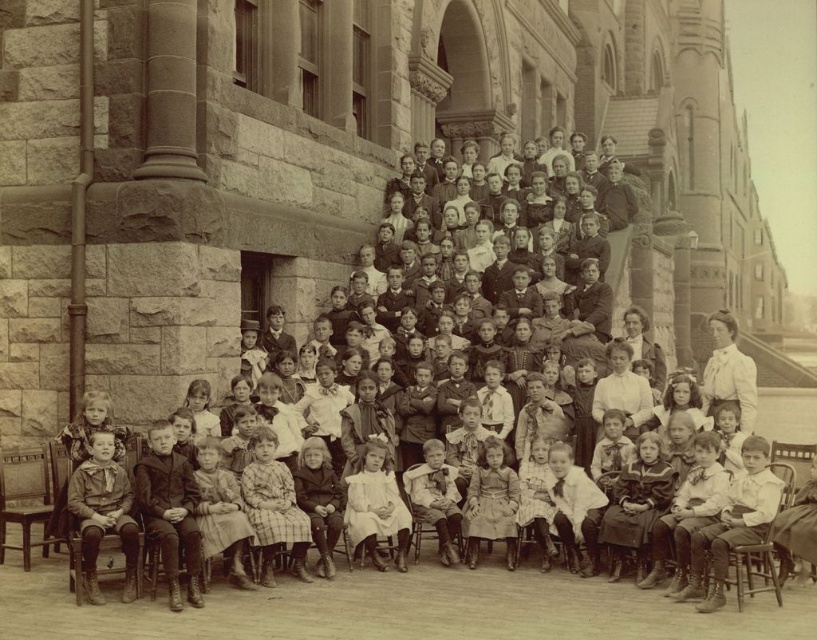
Question: Observing the image, what is the correct spatial positioning of matte brown boots at lower left in reference to white lace blouse at upper right?

Choices:
 (A) right
 (B) left

Answer: (B)

Question: Is matte brown boots at lower left closer to the viewer compared to wooden chair at lower left?

Choices:
 (A) yes
 (B) no

Answer: (A)

Question: Where is matte brown boots at lower left located in relation to wooden at right in the image?

Choices:
 (A) left
 (B) right

Answer: (A)

Question: Which point is closer to the camera?

Choices:
 (A) matte brown boots at lower left
 (B) wooden at right
 (C) wooden chair at lower left
 (D) white lace blouse at upper right

Answer: (A)

Question: Based on their relative distances, which object is farther from the wooden at right?

Choices:
 (A) white lace blouse at upper right
 (B) matte brown boots at lower left
 (C) wooden chair at lower left

Answer: (A)

Question: Among these points, which one is farthest from the camera?

Choices:
 (A) (735, 332)
 (B) (43, 497)

Answer: (A)